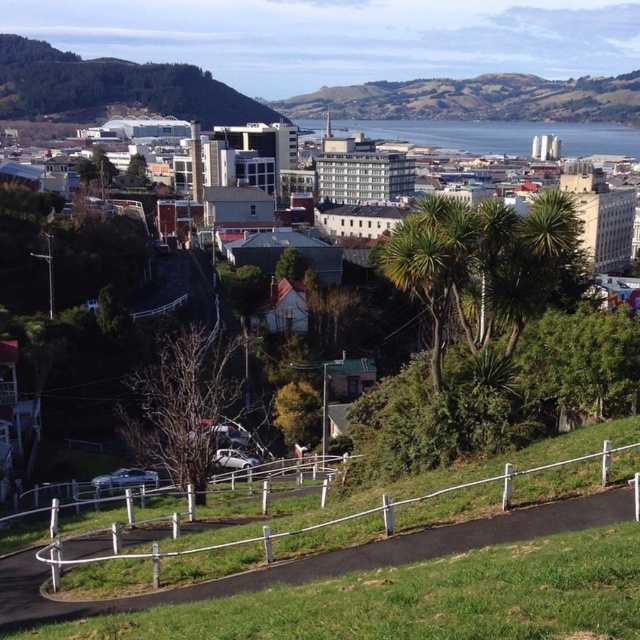
You are a city planner evaluating the park layout. You notice the white metal fence at lower center and the white plastic fence at center. Which fence is taller?

The white metal fence at lower center is taller than the white plastic fence at center.

You are standing on the green grass at lower center and want to walk to the blue water at center. Which direction should you go relative to your current position?

Since the green grass at lower center is in front of the blue water at center, you should walk forward towards the blue water at center to reach it.